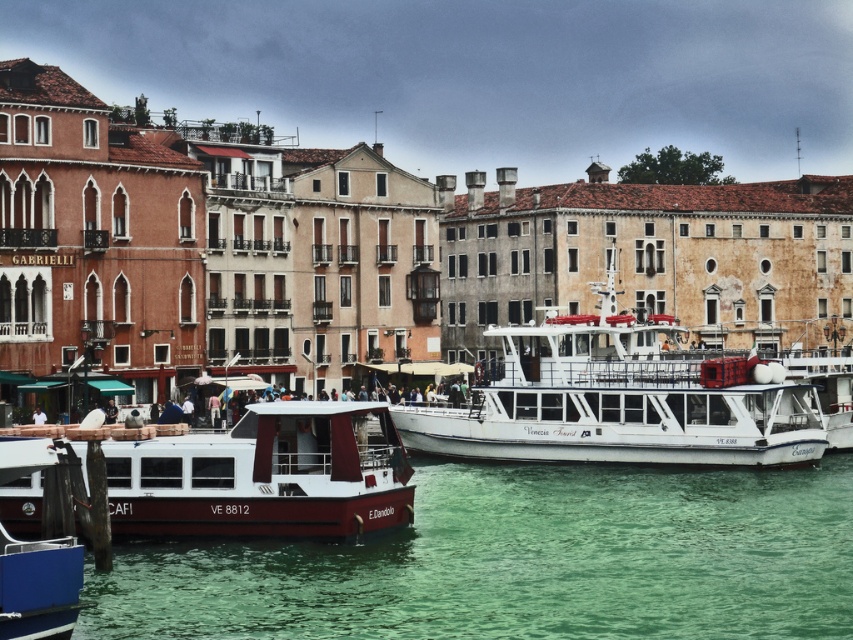
You are standing at the pier where the two boats are docked. You notice two points marked in the scene. Point A is at coordinates point (552, 512) and Point B is at point (289, 497). If you were to walk from Point A to Point B, would you be moving towards the canal or away from it?

Since point (552, 512) is further to the camera than point (289, 497), moving from Point A to Point B would mean moving towards the canal.

You are a tourist standing on the pier and want to take a photo of the green translucent water at center and the matte red boat at lower left. Which object should you focus on first if you want to include both in the same frame without moving your camera?

The green translucent water at center is below the matte red boat at lower left, so you should focus on the matte red boat at lower left first to ensure both are in the frame.

You are standing on the pier where the two boats are docked. You want to take a photo of both boats in the frame. If you move closer to the point at coordinates point (758, 400), will the point at coordinates point (260, 536) become more or less visible in your photo?

Moving closer to point (758, 400) will make point (260, 536) less visible because point (758, 400) is closer to the camera and may block the view of the farther point.